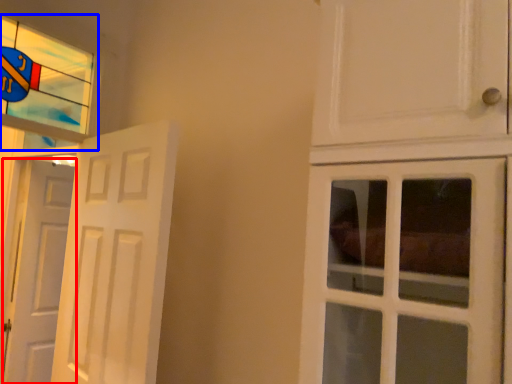
Question: Which object appears farthest to the camera in this image, door (highlighted by a red box) or window (highlighted by a blue box)?

Choices:
 (A) door
 (B) window

Answer: (A)